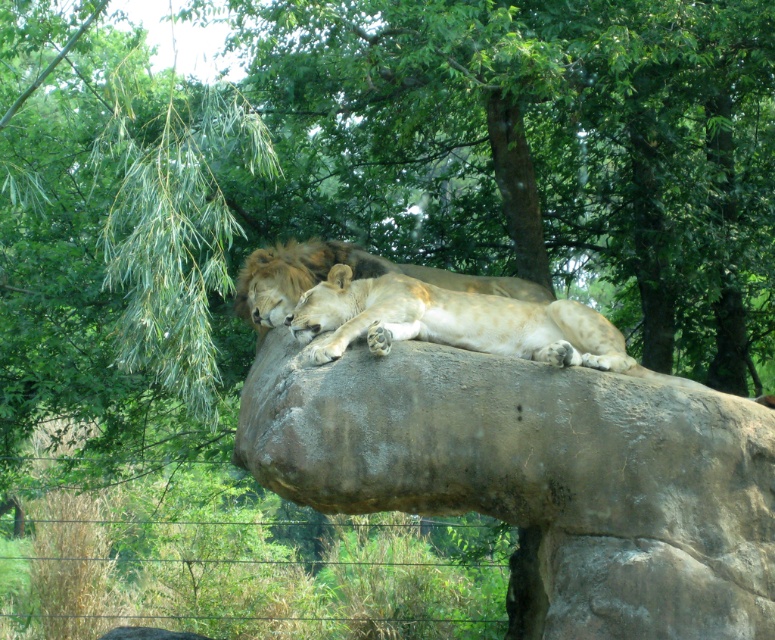
You are a wildlife photographer trying to capture a clear photo of both the light brown fur at center and the golden fur lion at center. Since you want to focus on the one that is taller, which lion should you adjust your camera settings for?

The light brown fur at center has a greater height compared to the golden fur lion at center, so you should adjust your camera settings to focus on the light brown fur at center.

You are a photographer standing in front of the rock formation where the lions are resting. You want to take a photo of the two points marked in the image. Which point, point (598, 368) or point (274, 276), is closer to you?

Point (598, 368) is closer to the viewer than point (274, 276).